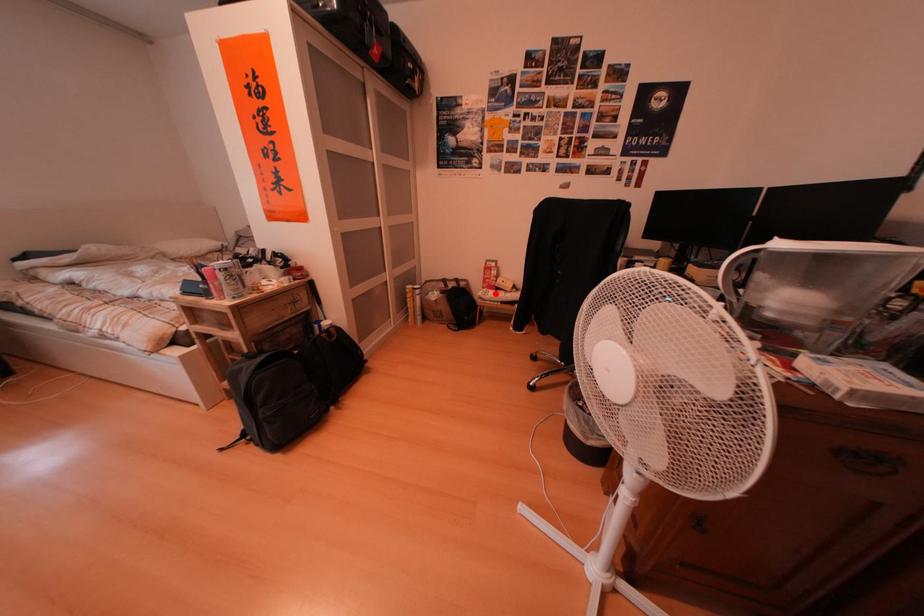
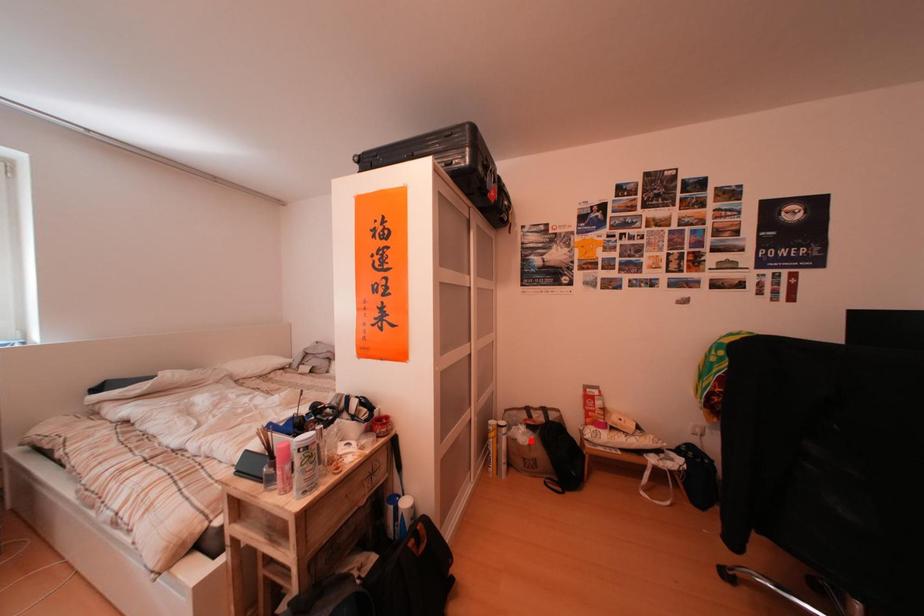
I am providing you with two images of the same scene from different viewpoints. A red point is marked on the first image and another point is marked on the second image. Are the points marked in image1 and image2 representing the same 3D position?

No